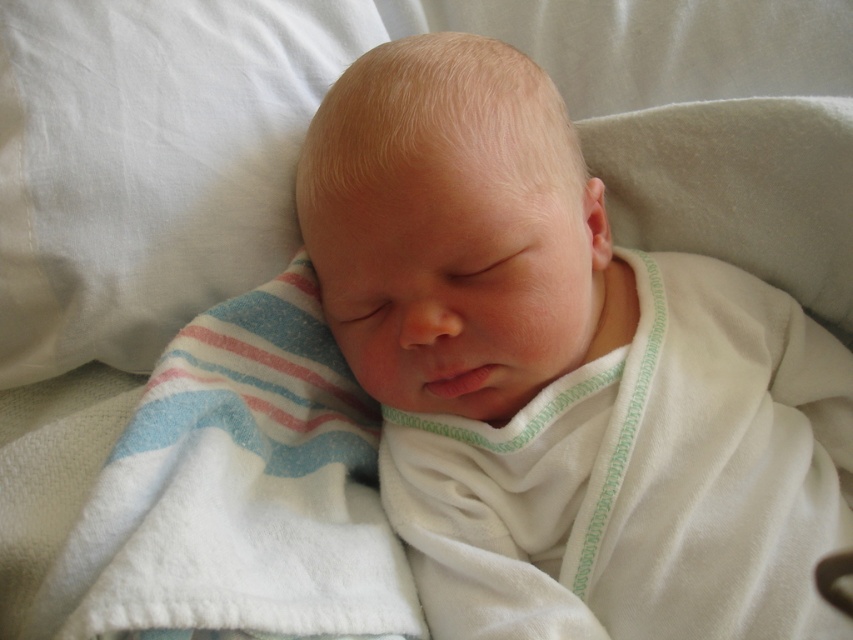
Is white cotton pillow at upper left below white soft blanket at center?

Actually, white cotton pillow at upper left is above white soft blanket at center.

Can you confirm if white cotton pillow at upper left is positioned to the right of white soft blanket at center?

In fact, white cotton pillow at upper left is to the left of white soft blanket at center.

Describe the element at coordinates (149, 163) in the screenshot. I see `white cotton pillow at upper left` at that location.

Locate an element on the screen. Image resolution: width=853 pixels, height=640 pixels. white cotton pillow at upper left is located at coordinates (149, 163).

Who is more distant from viewer, (450, 176) or (42, 44)?

Point (42, 44)

Who is more forward, (402, 340) or (186, 172)?

Point (402, 340) is more forward.

In order to click on smooth white baby at center in this screenshot , I will do `click(564, 372)`.

Which is above, smooth white baby at center or white soft blanket at center?

Positioned higher is smooth white baby at center.

Consider the image. Is the position of smooth white baby at center more distant than that of white soft blanket at center?

Yes, it is.

Between point (564, 524) and point (97, 636), which one is positioned in front?

Point (97, 636)

This screenshot has width=853, height=640. In order to click on smooth white baby at center in this screenshot , I will do `click(564, 372)`.